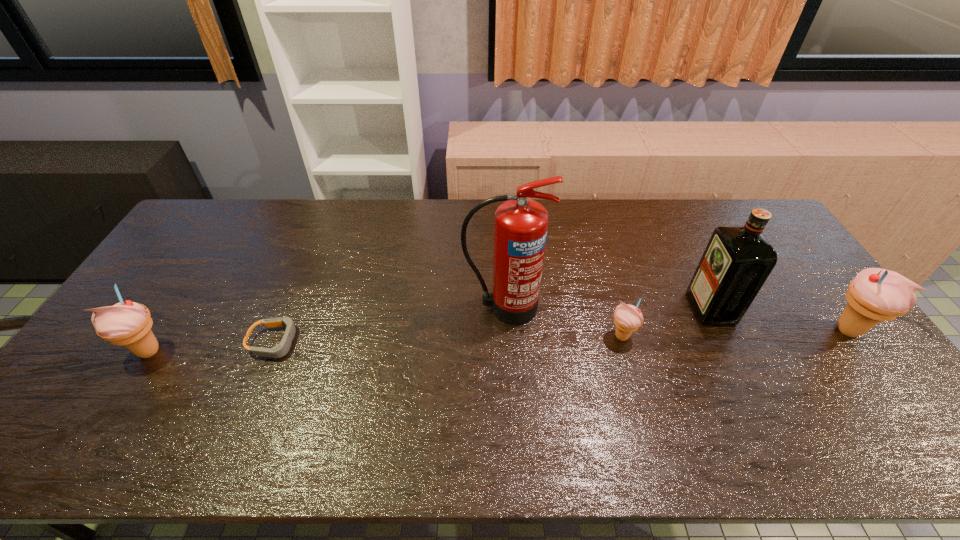
Locate an element on the screen. object that is at the right edge is located at coordinates (875, 295).

Find the location of a particular element. vacant space at the far edge is located at coordinates (593, 232).

Image resolution: width=960 pixels, height=540 pixels. In the image, there is a desktop. What are the coordinates of `vacant space at the near edge` in the screenshot? It's located at (672, 400).

In the image, there is a desktop. At what (x,y) coordinates should I click in order to perform the action: click on vacant space at the left edge. Please return your answer as a coordinate pair (x, y). The height and width of the screenshot is (540, 960). Looking at the image, I should click on (199, 261).

You are a GUI agent. You are given a task and a screenshot of the screen. Output one action in this format:
    pyautogui.click(x=<x>, y=<y>)
    Task: Click on the vacant region at the right edge of the desktop
    Image resolution: width=960 pixels, height=540 pixels.
    Given the screenshot: What is the action you would take?
    pyautogui.click(x=818, y=291)

Locate an element on the screen. Image resolution: width=960 pixels, height=540 pixels. unoccupied area between the leftmost object and the rightmost icecream is located at coordinates pos(498,340).

This screenshot has width=960, height=540. In order to click on free space between the fire extinguisher and the second tallest object in this screenshot , I will do pos(608,307).

Identify the location of blank region between the fifth shortest object and the second icecream from right to left. (666, 322).

Where is `vacant space that's between the fifth object from left to right and the fourth tallest object`? vacant space that's between the fifth object from left to right and the fourth tallest object is located at coordinates (430, 329).

What are the coordinates of `blank region between the rightmost icecream and the tallest object` in the screenshot? It's located at (676, 319).